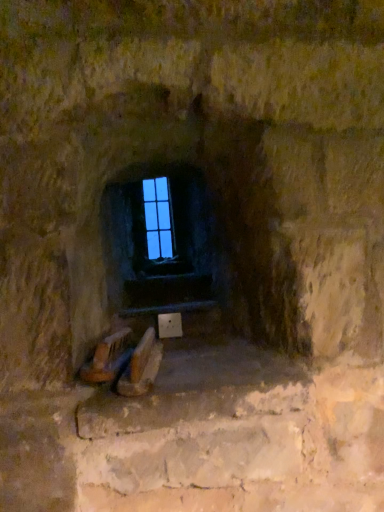
Question: From the image's perspective, relative to smooth stone stairwell at center, is transparent glass window at center above or below?

Choices:
 (A) above
 (B) below

Answer: (A)

Question: From a real-world perspective, relative to smooth stone stairwell at center, is transparent glass window at center vertically above or below?

Choices:
 (A) above
 (B) below

Answer: (A)

Question: Considering the relative positions of transparent glass window at center and smooth stone stairwell at center in the image provided, is transparent glass window at center to the left or to the right of smooth stone stairwell at center?

Choices:
 (A) left
 (B) right

Answer: (A)

Question: From the image's perspective, is smooth stone stairwell at center positioned above or below transparent glass window at center?

Choices:
 (A) above
 (B) below

Answer: (B)

Question: Is smooth stone stairwell at center taller or shorter than transparent glass window at center?

Choices:
 (A) short
 (B) tall

Answer: (A)

Question: In terms of size, does smooth stone stairwell at center appear bigger or smaller than transparent glass window at center?

Choices:
 (A) big
 (B) small

Answer: (A)

Question: In the image, is smooth stone stairwell at center positioned in front of or behind transparent glass window at center?

Choices:
 (A) front
 (B) behind

Answer: (A)